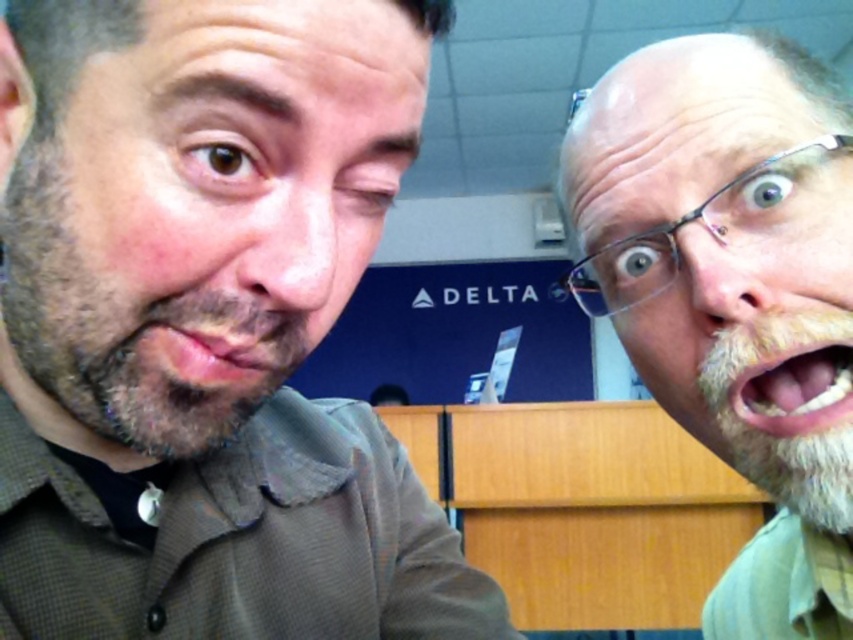
Between white beard at right and matte brown lips at center, which one appears on the left side from the viewer's perspective?

matte brown lips at center

The width and height of the screenshot is (853, 640). What are the coordinates of `white beard at right` in the screenshot? It's located at (724, 253).

Which is more to the left, brown textured shirt at left or pink flesh at center?

From the viewer's perspective, brown textured shirt at left appears more on the left side.

Is brown textured shirt at left bigger than pink flesh at center?

Yes.

What do you see at coordinates (192, 182) in the screenshot? This screenshot has width=853, height=640. I see `brown textured shirt at left` at bounding box center [192, 182].

Image resolution: width=853 pixels, height=640 pixels. I want to click on brown textured shirt at left, so 192,182.

Between point (248, 305) and point (808, 394), which one is positioned behind?

Positioned behind is point (808, 394).

Which is in front, point (297, 364) or point (769, 417)?

Point (297, 364) is in front.

What are the coordinates of `matte brown lips at center` in the screenshot? It's located at (222, 346).